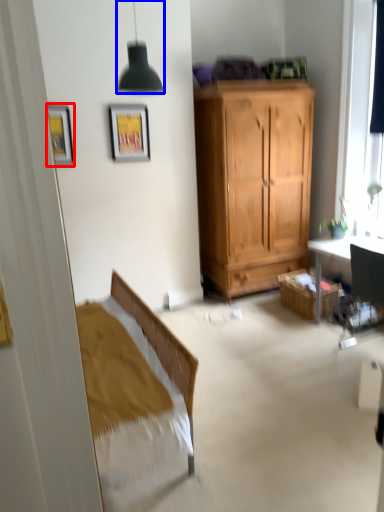
Question: Which of the following is the closest to the observer, picture frame (highlighted by a red box) or lamp (highlighted by a blue box)?

Choices:
 (A) picture frame
 (B) lamp

Answer: (B)